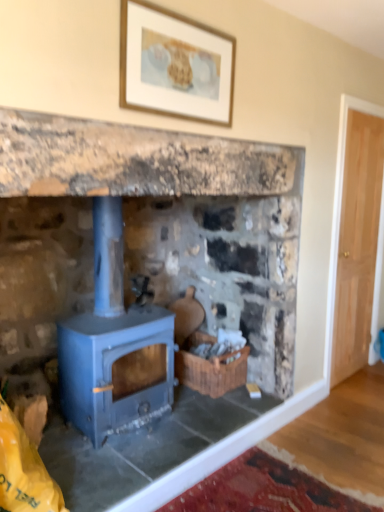
Question: Is woven brown basket at center positioned with its back to blue matte wood burning stove at center?

Choices:
 (A) no
 (B) yes

Answer: (A)

Question: Does woven brown basket at center come in front of blue matte wood burning stove at center?

Choices:
 (A) no
 (B) yes

Answer: (A)

Question: Does woven brown basket at center turn towards blue matte wood burning stove at center?

Choices:
 (A) no
 (B) yes

Answer: (A)

Question: Considering the relative sizes of woven brown basket at center and blue matte wood burning stove at center in the image provided, is woven brown basket at center bigger than blue matte wood burning stove at center?

Choices:
 (A) yes
 (B) no

Answer: (B)

Question: Can you confirm if woven brown basket at center is taller than blue matte wood burning stove at center?

Choices:
 (A) no
 (B) yes

Answer: (A)

Question: Considering the positions of point (213, 391) and point (147, 70), is point (213, 391) closer or farther from the camera than point (147, 70)?

Choices:
 (A) closer
 (B) farther

Answer: (B)

Question: Looking at the image, does woven brown basket at center seem bigger or smaller compared to wooden framed artwork at upper center?

Choices:
 (A) small
 (B) big

Answer: (B)

Question: Is woven brown basket at center inside or outside of wooden framed artwork at upper center?

Choices:
 (A) outside
 (B) inside

Answer: (A)

Question: Is woven brown basket at center wider or thinner than wooden framed artwork at upper center?

Choices:
 (A) thin
 (B) wide

Answer: (B)

Question: From a real-world perspective, is wooden framed artwork at upper center physically located above or below blue matte wood stove at center?

Choices:
 (A) above
 (B) below

Answer: (A)

Question: Considering their positions, is wooden framed artwork at upper center located in front of or behind blue matte wood stove at center?

Choices:
 (A) front
 (B) behind

Answer: (B)

Question: In terms of height, does wooden framed artwork at upper center look taller or shorter compared to blue matte wood stove at center?

Choices:
 (A) short
 (B) tall

Answer: (A)

Question: Would you say wooden framed artwork at upper center is to the left or to the right of blue matte wood stove at center in the picture?

Choices:
 (A) left
 (B) right

Answer: (B)

Question: Do you think blue matte wood stove at center is within woven brown basket at center, or outside of it?

Choices:
 (A) inside
 (B) outside

Answer: (B)

Question: Looking at the image, does blue matte wood stove at center seem bigger or smaller compared to woven brown basket at center?

Choices:
 (A) small
 (B) big

Answer: (B)